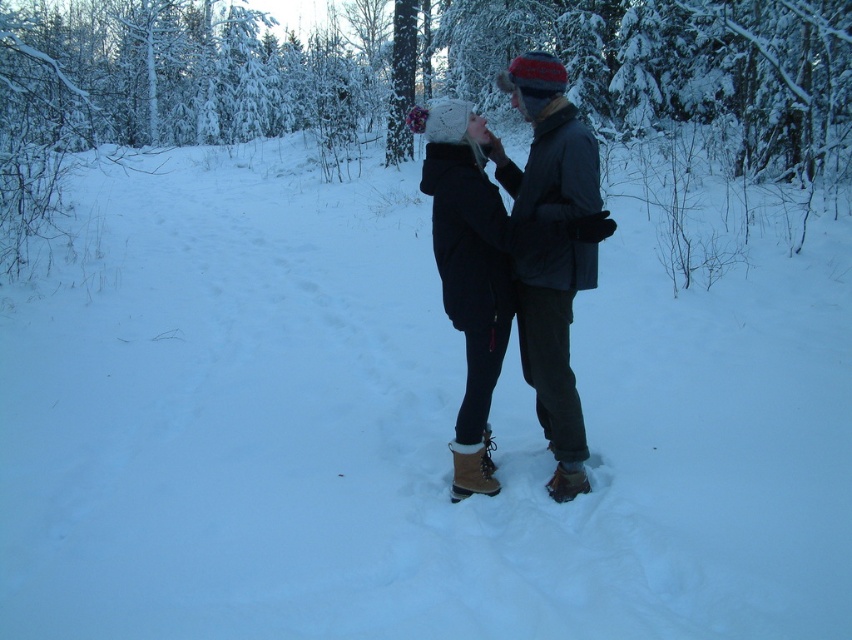
You are planning to go hiking in the snow and have two snowshoes available. You notice the brown suede snowshoe at center and the brown suede snowshoe at lower center. Which one should you choose if you want the larger one for better stability?

The brown suede snowshoe at center is larger in size than the brown suede snowshoe at lower center, so you should choose the brown suede snowshoe at center for better stability.

You are standing at the point marked by the coordinates point (x=532, y=236). Looking around, you see the dark gray woolen jacket at center. What object is located at your current position?

The point (x=532, y=236) indicates the location of the dark gray woolen jacket at center.

You are a photographer trying to capture a closeup of the dark gray woolen jacket at center and the knitted woolen hat at center. Your camera can focus on objects within a 5 inch range. Can you capture both items in focus without moving the camera?

The distance between the dark gray woolen jacket at center and the knitted woolen hat at center is 7.08 inches, which exceeds the camera focus range of 5 inches. Therefore, you cannot capture both items in focus without moving the camera.